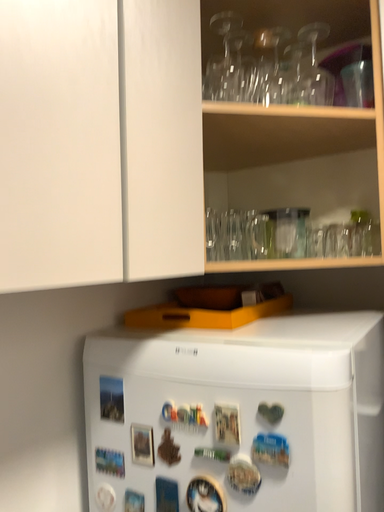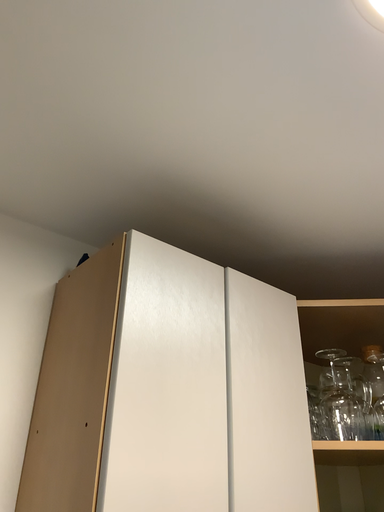
Question: Which way did the camera rotate in the video?

Choices:
 (A) rotated upward
 (B) rotated downward

Answer: (A)